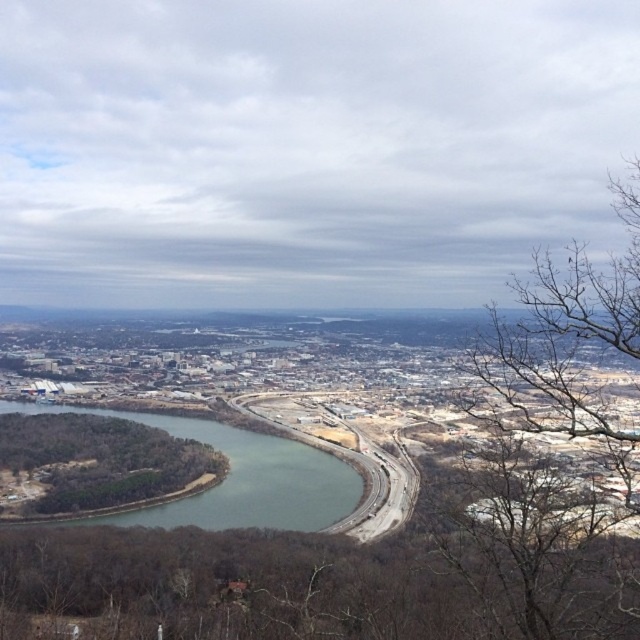
From the picture: You are a drone operator who needs to deliver a package from the green leafy tree at lower left to the green water at center. What is the approximate distance you need to cover?

The green leafy tree at lower left is 26.87 meters away from green water at center, so the approximate distance to cover is 26.87 meters.

You are standing at the vantage point overlooking the city and notice two points marked in the image. Which of the two points, point (83, 500) or point (348, 499), is closer to your current position?

Point (83, 500) is closer to your current position because it is further to the camera than point (348, 499).